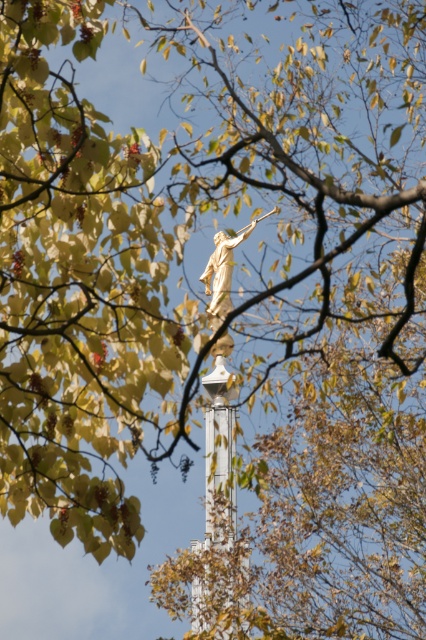
Question: Among these points, which one is farthest from the camera?

Choices:
 (A) (230, 266)
 (B) (245, 560)

Answer: (A)

Question: Which point appears closest to the camera in this image?

Choices:
 (A) (210, 305)
 (B) (210, 465)

Answer: (B)

Question: Which point appears farthest from the camera in this image?

Choices:
 (A) (216, 236)
 (B) (216, 582)

Answer: (A)

Question: Does white glossy tower at center appear on the left side of gold metallic statue at center?

Choices:
 (A) yes
 (B) no

Answer: (A)

Question: Does white glossy tower at center have a larger size compared to gold metallic statue at center?

Choices:
 (A) no
 (B) yes

Answer: (B)

Question: Does white glossy tower at center have a larger size compared to gold metallic statue at center?

Choices:
 (A) no
 (B) yes

Answer: (B)